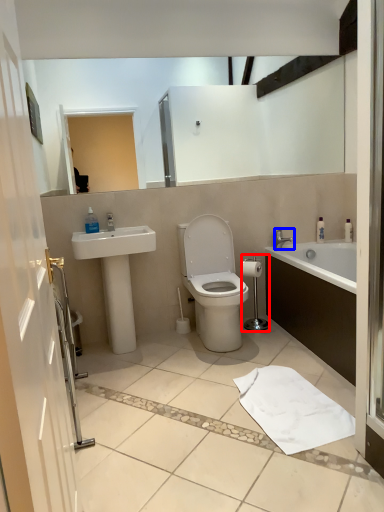
Question: Which point is closer to the camera, shower (highlighted by a red box) or tap (highlighted by a blue box)?

Choices:
 (A) shower
 (B) tap

Answer: (A)